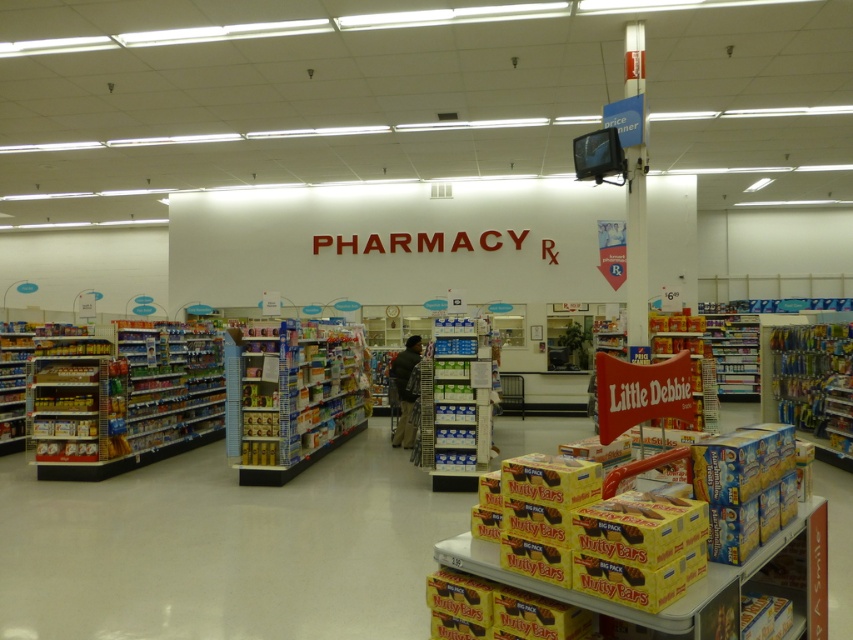
Question: Which object is the closest to the white cardboard shelf at center?

Choices:
 (A) blue plastic shelf at center
 (B) dark green fabric jacket at center

Answer: (B)

Question: In this image, where is blue plastic shelf at center located relative to white cardboard shelf at center?

Choices:
 (A) right
 (B) left

Answer: (B)

Question: Which is farther from the dark green fabric jacket at center?

Choices:
 (A) white cardboard shelf at center
 (B) blue plastic shelf at center

Answer: (A)

Question: Is white cardboard shelf at center further to camera compared to dark green fabric jacket at center?

Choices:
 (A) yes
 (B) no

Answer: (B)

Question: Which object is farther from the camera taking this photo?

Choices:
 (A) blue plastic shelf at center
 (B) dark green fabric jacket at center

Answer: (B)

Question: Is blue plastic shelf at center above dark green fabric jacket at center?

Choices:
 (A) yes
 (B) no

Answer: (A)